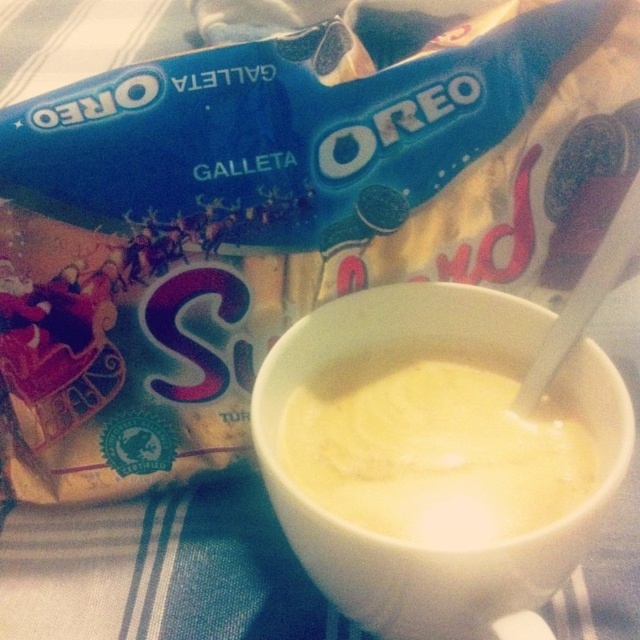
Question: Is yellow creamy liquid at center thinner than yellow creamy soup at center?

Choices:
 (A) no
 (B) yes

Answer: (A)

Question: Is yellow creamy liquid at center above yellow creamy soup at center?

Choices:
 (A) yes
 (B) no

Answer: (A)

Question: Does yellow creamy liquid at center have a smaller size compared to yellow creamy soup at center?

Choices:
 (A) no
 (B) yes

Answer: (A)

Question: Among these objects, which one is nearest to the camera?

Choices:
 (A) yellow creamy soup at center
 (B) yellow creamy liquid at center

Answer: (B)